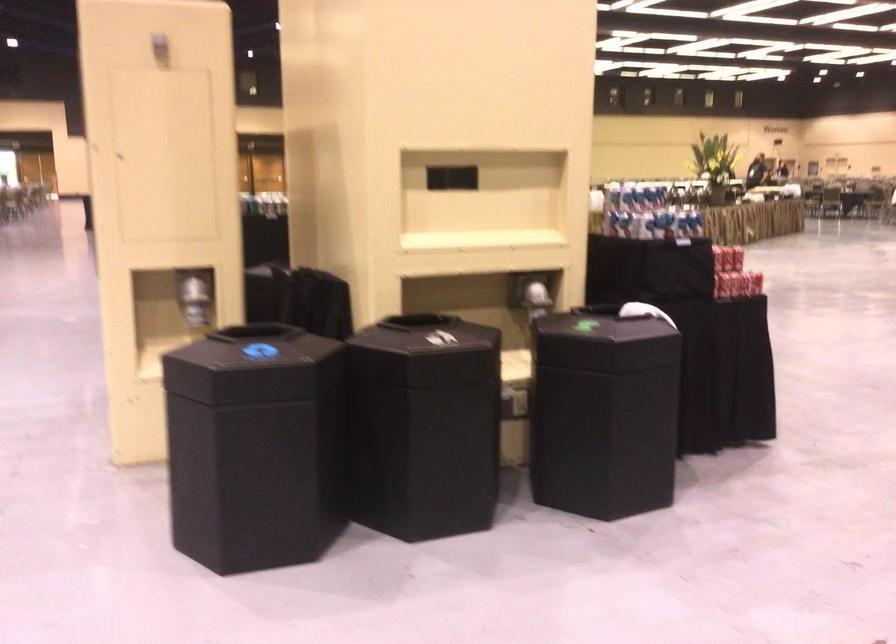
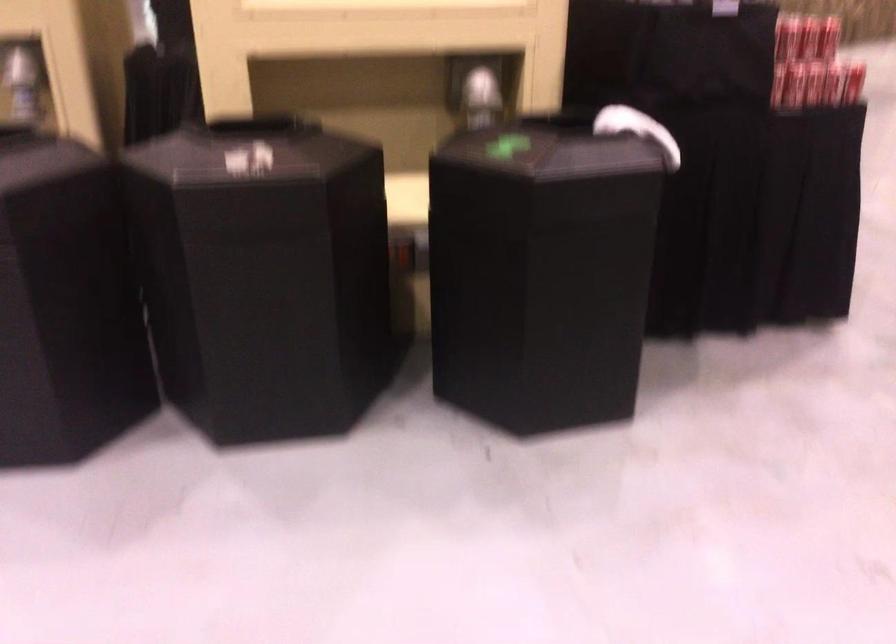
What movement of the cameraman would produce the second image?

The movement direction of the cameraman is right, forward.